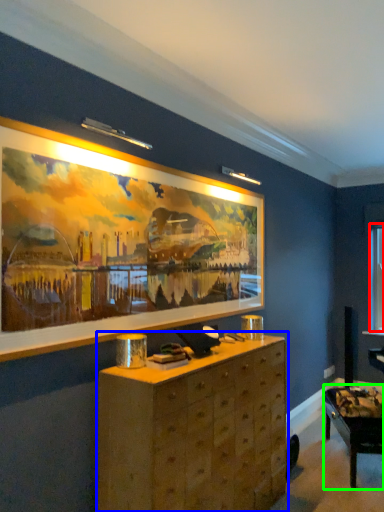
Question: Which is farther away from window (highlighted by a red box)? chest of drawers (highlighted by a blue box) or table (highlighted by a green box)?

Choices:
 (A) chest of drawers
 (B) table

Answer: (A)